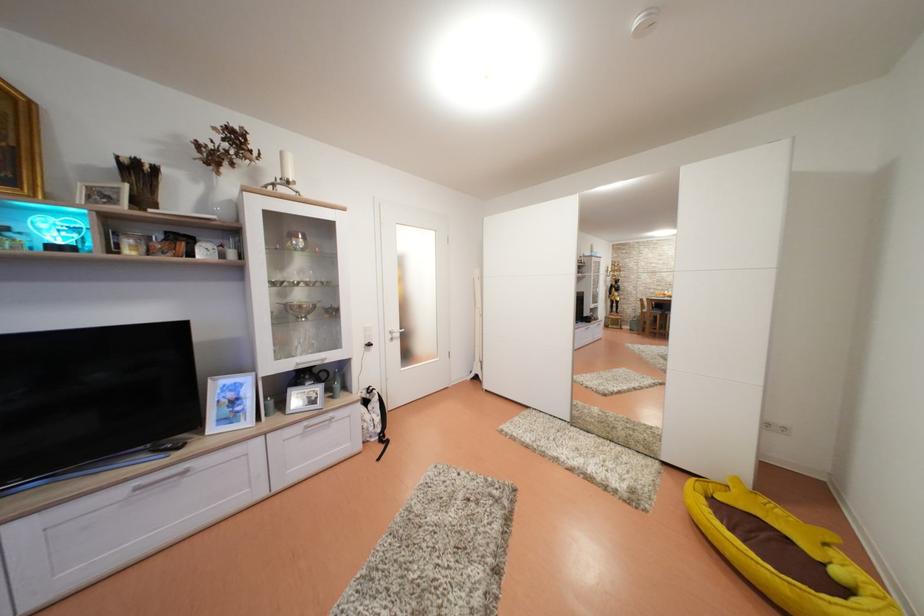
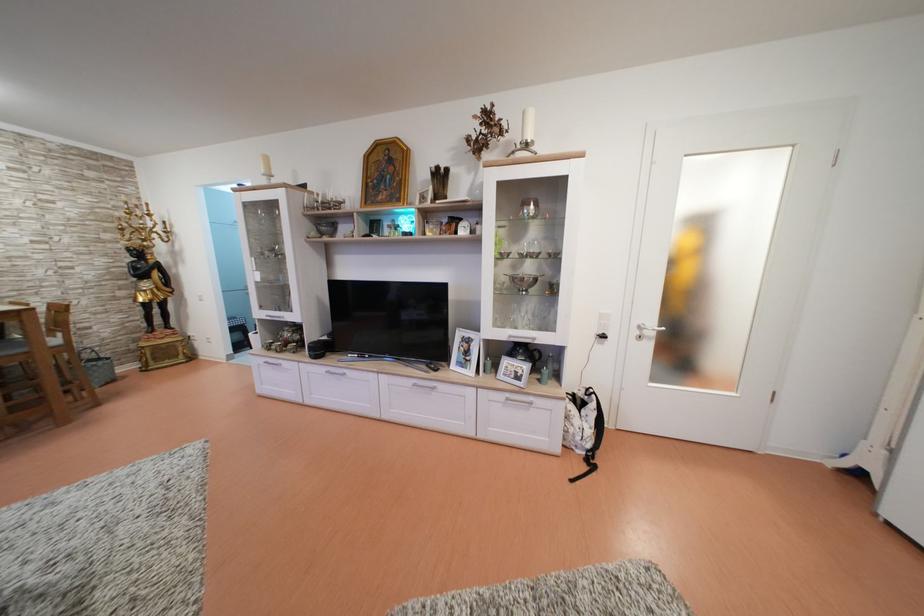
Where in the second image is the point corresponding to (397,338) from the first image?

(647, 333)